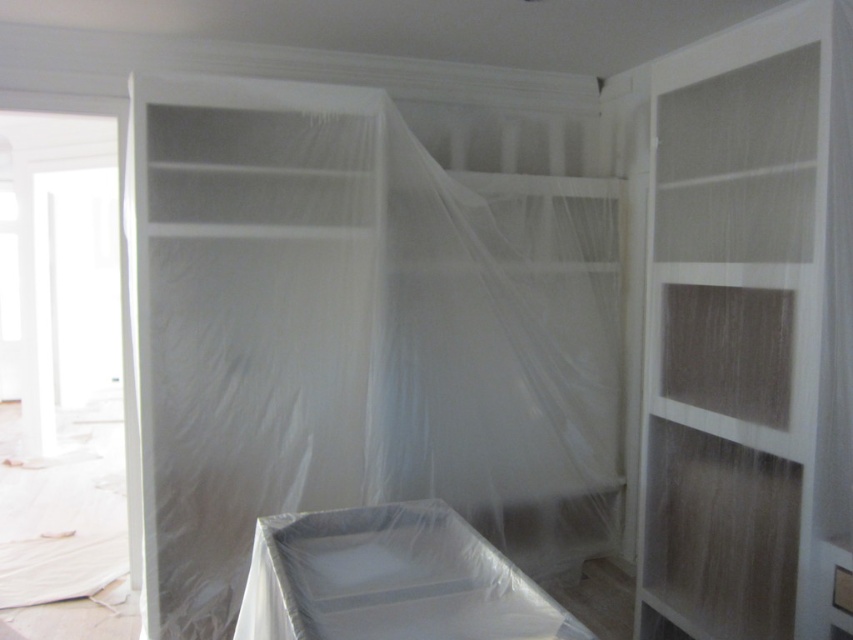
You are standing in front of the shelving unit and see two points marked on the protective plastic sheet. The first point is at coordinate point (347,115) and the second point is at coordinate point (775,282). Which point is closer to you?

Point (347,115) is further to the camera than point (775,282), so the point closer to you is point (775,282).

You are an interior designer assessing the space. You need to determine if the transparent plastic curtain at center can fully cover the white matte wood shelf at center. Based on the information provided, can it?

The transparent plastic curtain at center might be wider than white matte wood shelf at center, so there is a possibility that it can fully cover the shelf. However, the exact dimensions are not specified, so further measurement would be needed to confirm.